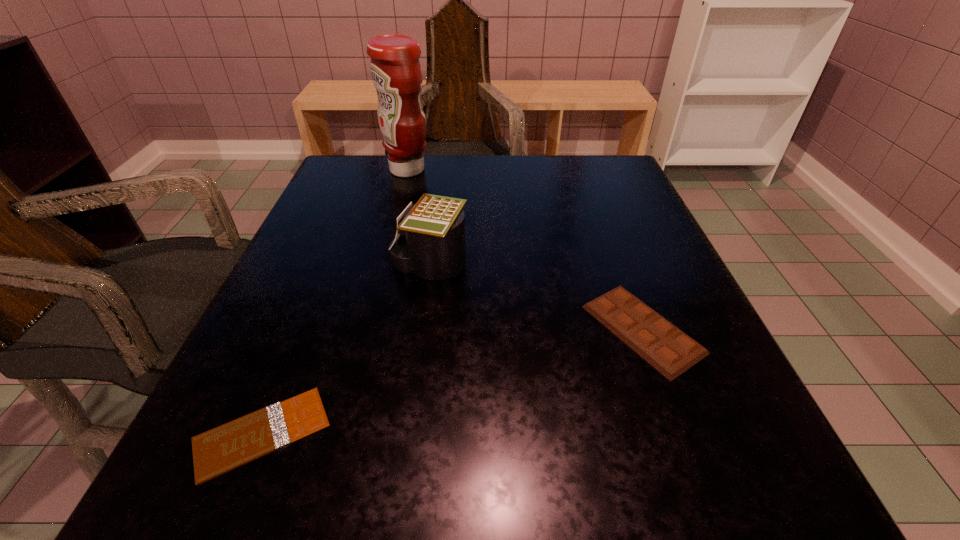
The width and height of the screenshot is (960, 540). In order to click on vacant space situated on the right of the shortest object in this screenshot , I will do `click(517, 433)`.

Identify the location of object at the far edge. This screenshot has height=540, width=960. (396, 73).

Where is `object located in the near edge section of the desktop`? Image resolution: width=960 pixels, height=540 pixels. object located in the near edge section of the desktop is located at coordinates (217, 451).

At what (x,y) coordinates should I click in order to perform the action: click on condiment located in the left edge section of the desktop. Please return your answer as a coordinate pair (x, y). This screenshot has width=960, height=540. Looking at the image, I should click on (396, 73).

Locate an element on the screen. chocolate bar located at the left edge is located at coordinates (217, 451).

Where is `object that is at the right edge`? The image size is (960, 540). object that is at the right edge is located at coordinates (669, 350).

I want to click on object present at the far left corner, so click(396, 73).

Locate an element on the screen. This screenshot has width=960, height=540. object at the near left corner is located at coordinates (217, 451).

Image resolution: width=960 pixels, height=540 pixels. Identify the location of free space at the far edge. (533, 164).

The height and width of the screenshot is (540, 960). In order to click on free space at the near edge in this screenshot , I will do `click(606, 491)`.